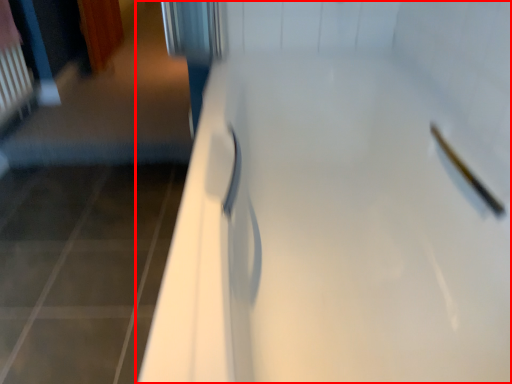
Question: Where is door (annotated by the red box) located in relation to shower in the image?

Choices:
 (A) left
 (B) right

Answer: (A)